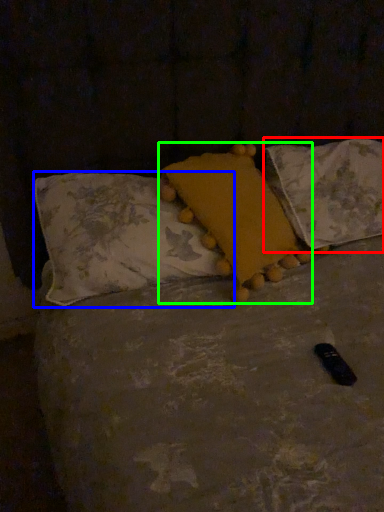
Question: Based on their relative distances, which object is nearer to pillow (highlighted by a red box)? Choose from pillow (highlighted by a blue box) and pillow (highlighted by a green box).

Choices:
 (A) pillow
 (B) pillow

Answer: (B)